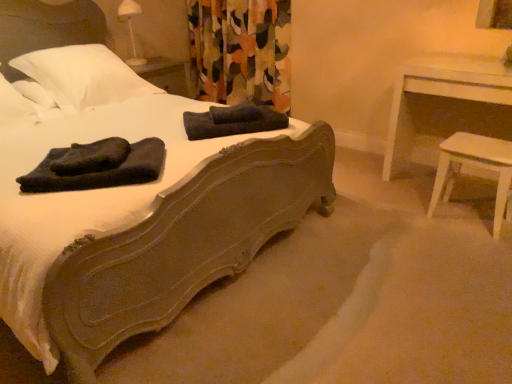
I want to click on empty space that is ontop of white wood stool at right, so click(x=482, y=144).